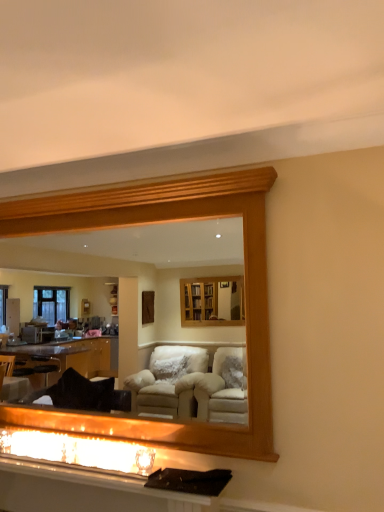
Measure the distance between wooden frame at upper center and camera.

wooden frame at upper center and camera are 10.13 feet apart from each other.

Describe the element at coordinates (73, 450) in the screenshot. I see `matte glass fireplace at lower center` at that location.

Where is `matte white vanity at lower center`? This screenshot has width=384, height=512. matte white vanity at lower center is located at coordinates (86, 490).

The width and height of the screenshot is (384, 512). I want to click on wooden frame at upper center, so click(132, 270).

Is matte white vanity at lower center shorter than wooden frame at upper center?

Correct, matte white vanity at lower center is not as tall as wooden frame at upper center.

In the scene shown: Between matte white vanity at lower center and wooden frame at upper center, which one has smaller width?

Thinner between the two is wooden frame at upper center.

Is matte white vanity at lower center not close to wooden frame at upper center?

Yes, matte white vanity at lower center and wooden frame at upper center are quite far apart.

Which point is more distant from viewer, (36,489) or (213,268)?

Positioned behind is point (213,268).

Between matte glass fireplace at lower center and wooden frame at upper center, which one has more height?

Standing taller between the two is wooden frame at upper center.

From a real-world perspective, between matte glass fireplace at lower center and wooden frame at upper center, who is vertically lower?

In real-world perspective, matte glass fireplace at lower center is lower.

Could you tell me if matte glass fireplace at lower center is turned towards wooden frame at upper center?

No, matte glass fireplace at lower center is not oriented towards wooden frame at upper center.

Is matte glass fireplace at lower center directly adjacent to wooden frame at upper center?

No, matte glass fireplace at lower center is not with wooden frame at upper center.

From a real-world perspective, between wooden frame at upper center and matte glass fireplace at lower center, who is vertically lower?

matte glass fireplace at lower center, from a real-world perspective.

Which object is wider, wooden frame at upper center or matte glass fireplace at lower center?

matte glass fireplace at lower center.

Does wooden frame at upper center have a larger size compared to matte glass fireplace at lower center?

Yes, wooden frame at upper center is bigger than matte glass fireplace at lower center.

Measure the distance between wooden frame at upper center and matte glass fireplace at lower center.

The distance of wooden frame at upper center from matte glass fireplace at lower center is 2.88 meters.

Who is bigger, wooden frame at upper center or matte white vanity at lower center?

wooden frame at upper center.

How different are the orientations of wooden frame at upper center and matte white vanity at lower center in degrees?

The angle between the facing direction of wooden frame at upper center and the facing direction of matte white vanity at lower center is 0.000916 degrees.

Between wooden frame at upper center and matte white vanity at lower center, which one has larger width?

With larger width is matte white vanity at lower center.

Is matte white vanity at lower center located within wooden frame at upper center?

No, matte white vanity at lower center is not a part of wooden frame at upper center.

I want to click on reflection behind the matte white vanity at lower center, so click(73, 450).

Which of these two, matte glass fireplace at lower center or matte white vanity at lower center, is smaller?

Smaller between the two is matte glass fireplace at lower center.

Does matte glass fireplace at lower center appear on the right side of matte white vanity at lower center?

No, matte glass fireplace at lower center is not to the right of matte white vanity at lower center.

Considering the sizes of objects matte glass fireplace at lower center and matte white vanity at lower center in the image provided, who is shorter, matte glass fireplace at lower center or matte white vanity at lower center?

matte white vanity at lower center is shorter.

Considering the positions of objects matte white vanity at lower center and matte glass fireplace at lower center in the image provided, who is in front, matte white vanity at lower center or matte glass fireplace at lower center?

matte white vanity at lower center is more forward.

Which is closer, (x=2, y=483) or (x=27, y=445)?

Point (x=2, y=483).

From the picture: From a real-world perspective, relative to matte glass fireplace at lower center, is matte white vanity at lower center vertically above or below?

matte white vanity at lower center is situated lower than matte glass fireplace at lower center in the real world.

At what (x,y) coordinates should I click in order to perform the action: click on vanity below the wooden frame at upper center (from the image's perspective). Please return your answer as a coordinate pair (x, y). Looking at the image, I should click on (86, 490).

The height and width of the screenshot is (512, 384). Identify the location of mirror above the matte glass fireplace at lower center (from the image's perspective). (132, 270).

Considering their positions, is matte white vanity at lower center positioned closer to matte glass fireplace at lower center than wooden frame at upper center?

matte white vanity at lower center.

Considering their positions, is wooden frame at upper center positioned further to matte glass fireplace at lower center than matte white vanity at lower center?

wooden frame at upper center is positioned further to the anchor matte glass fireplace at lower center.

Estimate the real-world distances between objects in this image. Which object is further from matte white vanity at lower center, wooden frame at upper center or matte glass fireplace at lower center?

Among the two, wooden frame at upper center is located further to matte white vanity at lower center.

Considering their positions, is matte glass fireplace at lower center positioned further to matte white vanity at lower center than wooden frame at upper center?

wooden frame at upper center.

Considering their positions, is matte glass fireplace at lower center positioned closer to wooden frame at upper center than matte white vanity at lower center?

matte glass fireplace at lower center.

From the image, which object appears to be farther from wooden frame at upper center, matte white vanity at lower center or matte glass fireplace at lower center?

matte white vanity at lower center is positioned further to the anchor wooden frame at upper center.

The image size is (384, 512). I want to click on reflection between wooden frame at upper center and matte white vanity at lower center in the up-down direction, so click(73, 450).